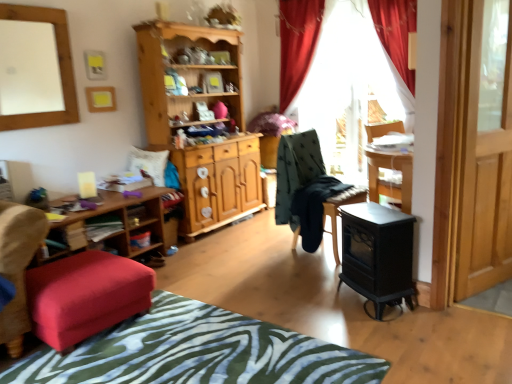
In order to click on free space between dark green fabric chair at center and zebra print fabric at lower center in this screenshot , I will do `click(284, 291)`.